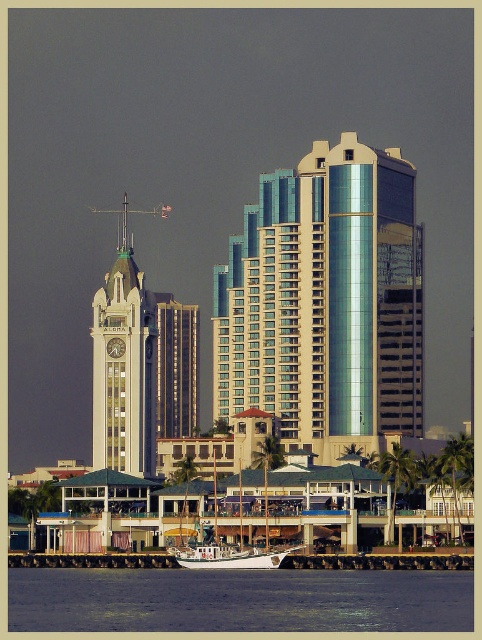
Is point (470, 608) positioned in front of point (124, 244)?

Yes, it is in front of point (124, 244).

Measure the distance from blue water at lower center to white stone clock tower at left.

They are 78.15 meters apart.

Image resolution: width=482 pixels, height=640 pixels. Describe the element at coordinates (239, 600) in the screenshot. I see `blue water at lower center` at that location.

This screenshot has width=482, height=640. What are the coordinates of `blue water at lower center` in the screenshot? It's located at (239, 600).

Which is more to the left, wooden dock at lower center or white matte boat at lower center?

Positioned to the left is wooden dock at lower center.

Describe the element at coordinates (378, 561) in the screenshot. The image size is (482, 640). I see `wooden dock at lower center` at that location.

Locate an element on the screen. The image size is (482, 640). wooden dock at lower center is located at coordinates (378, 561).

Who is higher up, white stone clock tower at left or white matte boat at lower center?

white stone clock tower at left is higher up.

Can you confirm if white stone clock tower at left is bigger than white matte boat at lower center?

Indeed, white stone clock tower at left has a larger size compared to white matte boat at lower center.

Find the location of `white stone clock tower at left`. white stone clock tower at left is located at coordinates (124, 360).